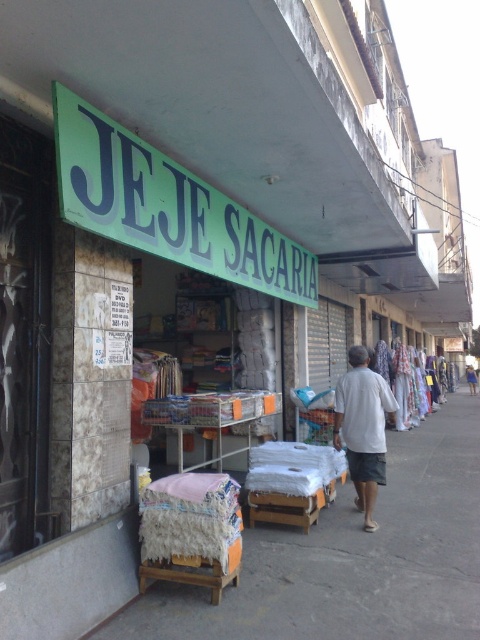
Based on the photo, is green plastic sign at upper center positioned at the back of white cotton dress at center?

No, it is in front of white cotton dress at center.

Is green plastic sign at upper center shorter than white cotton dress at center?

Incorrect, green plastic sign at upper center's height does not fall short of white cotton dress at center's.

Find the location of a particular element. green plastic sign at upper center is located at coordinates (168, 205).

Can you confirm if white fabric at center is positioned to the left of green plastic sign at upper center?

No, white fabric at center is not to the left of green plastic sign at upper center.

Who is positioned more to the right, white fabric at center or green plastic sign at upper center?

Positioned to the right is white fabric at center.

Where is `white fabric at center`? Image resolution: width=480 pixels, height=640 pixels. white fabric at center is located at coordinates (352, 557).

Can you confirm if green plastic sign at upper center is positioned to the right of white cotton shirt at center?

In fact, green plastic sign at upper center is to the left of white cotton shirt at center.

Does point (68, 97) lie behind point (377, 422)?

That is False.

You are a GUI agent. You are given a task and a screenshot of the screen. Output one action in this format:
    pyautogui.click(x=<x>, y=<y>)
    Task: Click on the green plastic sign at upper center
    Image resolution: width=480 pixels, height=640 pixels.
    Given the screenshot: What is the action you would take?
    pyautogui.click(x=168, y=205)

Locate an element on the screen. This screenshot has width=480, height=640. green plastic sign at upper center is located at coordinates (168, 205).